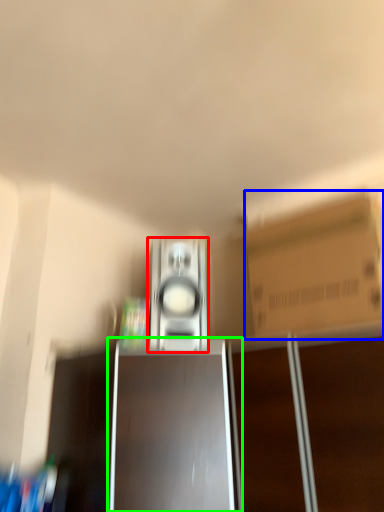
Question: Considering the real-world distances, which object is farthest from home appliance (highlighted by a red box)? cardboard box (highlighted by a blue box) or cabinetry (highlighted by a green box)?

Choices:
 (A) cardboard box
 (B) cabinetry

Answer: (A)